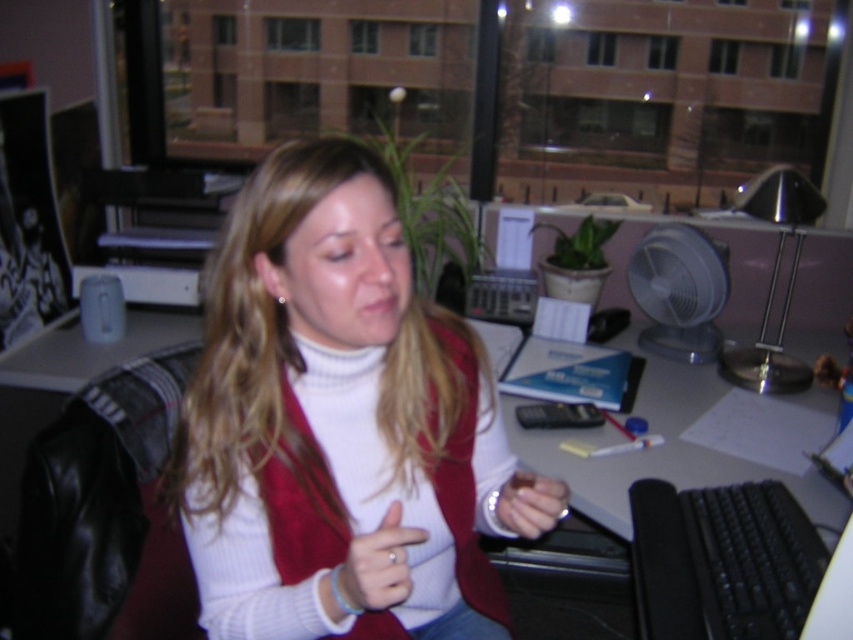
Does white soft sweater at center have a larger size compared to clear plastic fan at right?

Yes.

Who is more distant from viewer, (366, 176) or (724, 257)?

The point (724, 257) is behind.

Is point (267, 486) farther from camera compared to point (653, 280)?

No.

Identify the location of white soft sweater at center. (x=332, y=416).

Is clear plastic fan at right smaller than matte silver ring at center?

No.

Is point (701, 248) positioned behind point (521, 490)?

Yes.

Is point (662, 323) behind point (524, 490)?

That is True.

Locate an element on the screen. This screenshot has height=640, width=853. clear plastic fan at right is located at coordinates (679, 291).

Who is shorter, white soft sweater at center or matte white hand at center?

With less height is matte white hand at center.

Which is behind, point (316, 595) or point (383, 545)?

Point (316, 595)

Find the location of `white soft sweater at center`. white soft sweater at center is located at coordinates (332, 416).

Where is `white soft sweater at center`? This screenshot has width=853, height=640. white soft sweater at center is located at coordinates (332, 416).